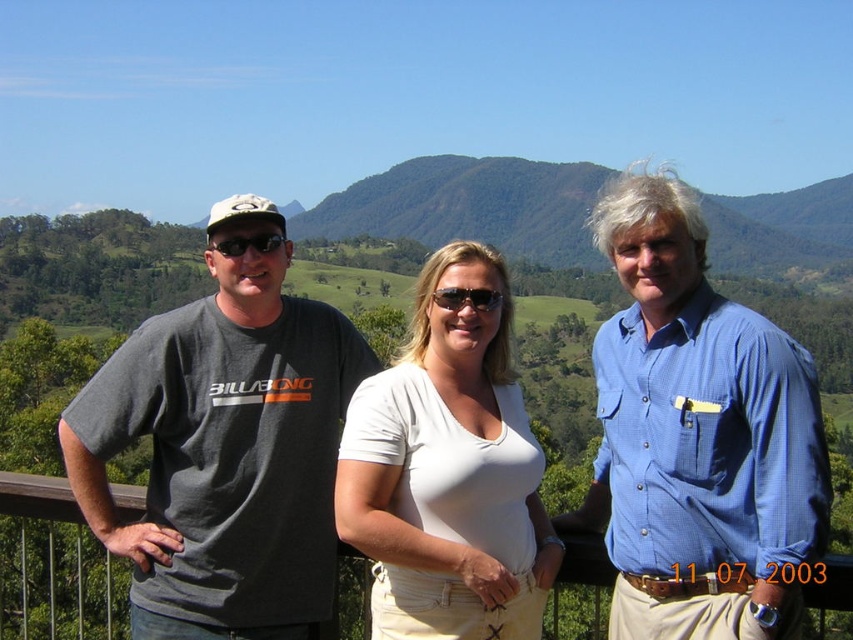
This screenshot has width=853, height=640. Describe the element at coordinates (697, 435) in the screenshot. I see `gray cotton t-shirt at left` at that location.

Which of these two, gray cotton t-shirt at left or dark gray t-shirt at left, stands taller?

With more height is gray cotton t-shirt at left.

Which is in front, point (596, 461) or point (112, 397)?

Point (112, 397) is more forward.

Find the location of `gray cotton t-shirt at left`. gray cotton t-shirt at left is located at coordinates (697, 435).

Is blue textured shirt at center thinner than black plastic sunglasses at center?

Incorrect, blue textured shirt at center's width is not less than black plastic sunglasses at center's.

Does blue textured shirt at center have a larger size compared to black plastic sunglasses at center?

Indeed, blue textured shirt at center has a larger size compared to black plastic sunglasses at center.

Does point (735, 529) lie behind point (229, 248)?

No, it is in front of (229, 248).

At what (x,y) coordinates should I click in order to perform the action: click on blue textured shirt at center. Please return your answer as a coordinate pair (x, y). This screenshot has width=853, height=640. Looking at the image, I should click on pyautogui.click(x=697, y=436).

Which is in front, point (260, 525) or point (498, 636)?

Positioned in front is point (498, 636).

Based on the photo, does dark gray t-shirt at left appear on the right side of white cotton shirt at center?

Incorrect, dark gray t-shirt at left is not on the right side of white cotton shirt at center.

What do you see at coordinates (224, 448) in the screenshot? The height and width of the screenshot is (640, 853). I see `dark gray t-shirt at left` at bounding box center [224, 448].

The width and height of the screenshot is (853, 640). I want to click on dark gray t-shirt at left, so click(224, 448).